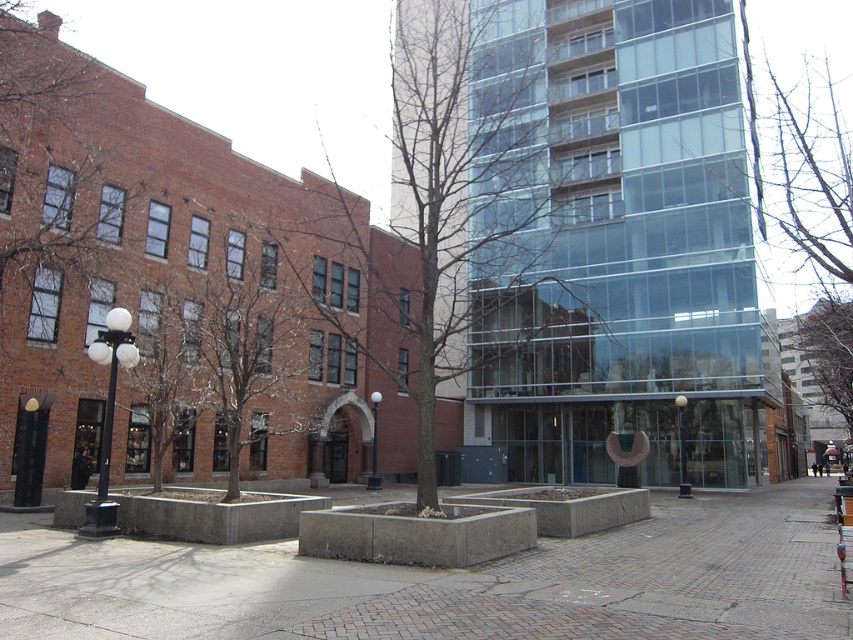
Question: Is brown bark tree at center bigger than brown textured tree at center?

Choices:
 (A) yes
 (B) no

Answer: (A)

Question: Which point is closer to the camera?

Choices:
 (A) bare branches at upper center
 (B) brown textured tree at center
 (C) brown textured tree at upper left
 (D) brown bark tree at left

Answer: (B)

Question: Which point is farther from the camera taking this photo?

Choices:
 (A) (3, 228)
 (B) (820, 328)

Answer: (B)

Question: Can you confirm if brown textured tree at upper left is positioned below bare branches at upper center?

Choices:
 (A) yes
 (B) no

Answer: (A)

Question: Can you confirm if brown bark tree at center is smaller than brown textured tree at upper left?

Choices:
 (A) yes
 (B) no

Answer: (B)

Question: Which of the following is the farthest from the observer?

Choices:
 (A) (492, 240)
 (B) (71, 134)
 (C) (166, 330)

Answer: (A)